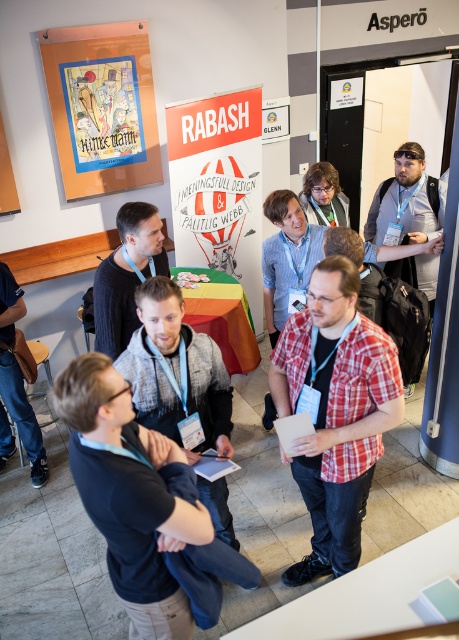
Question: Which point is farther to the camera?

Choices:
 (A) matte black shirt at center
 (B) gray fabric shirt at right
 (C) black matte shirt at center
 (D) matte paper poster at upper left

Answer: (D)

Question: Can you confirm if light blue shirt at center is positioned to the right of dark blue jeans at lower left?

Choices:
 (A) yes
 (B) no

Answer: (A)

Question: Which point is closer to the camera taking this photo?

Choices:
 (A) (56, 36)
 (B) (169, 410)

Answer: (B)

Question: Can you confirm if white paperboard at center is thinner than gray fabric shirt at right?

Choices:
 (A) no
 (B) yes

Answer: (A)

Question: Among these points, which one is nearest to the camera?

Choices:
 (A) (67, 84)
 (B) (173, 154)

Answer: (A)

Question: Is red plaid shirt at center above black matte shirt at center?

Choices:
 (A) no
 (B) yes

Answer: (A)